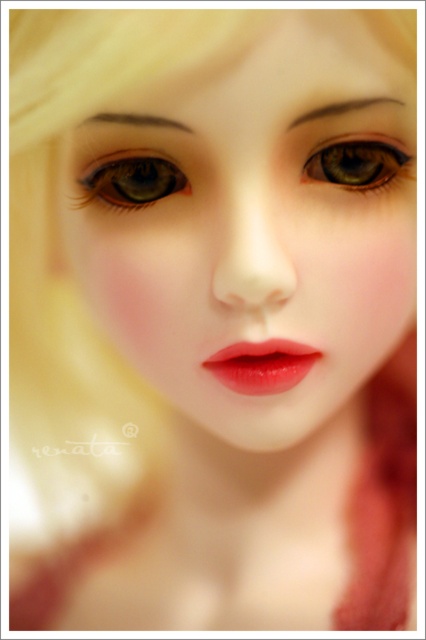
Looking at the doll in the image, which object is positioned to the right side of the other between the matte green eye at center and the brown glossy eye at upper center?

The brown glossy eye at upper center is positioned to the right of the matte green eye at center.

You are a photographer adjusting your camera settings to capture the doll in focus. The camera can only focus on objects within a 12 inch range from the lens. Given the point at coordinates point (184, 170), will the camera be able to focus on it?

The distance between the point (184, 170) and the viewer is 13.18 inches. Since the camera can only focus within 12 inches, the camera will not be able to focus on the point (184, 170) as it is slightly beyond the focus range.

Looking at the doll in the image, which object is bigger between the glossy matte lips at center and the brown glossy eye at upper center?

The glossy matte lips at center are larger in size compared to the brown glossy eye at upper center.